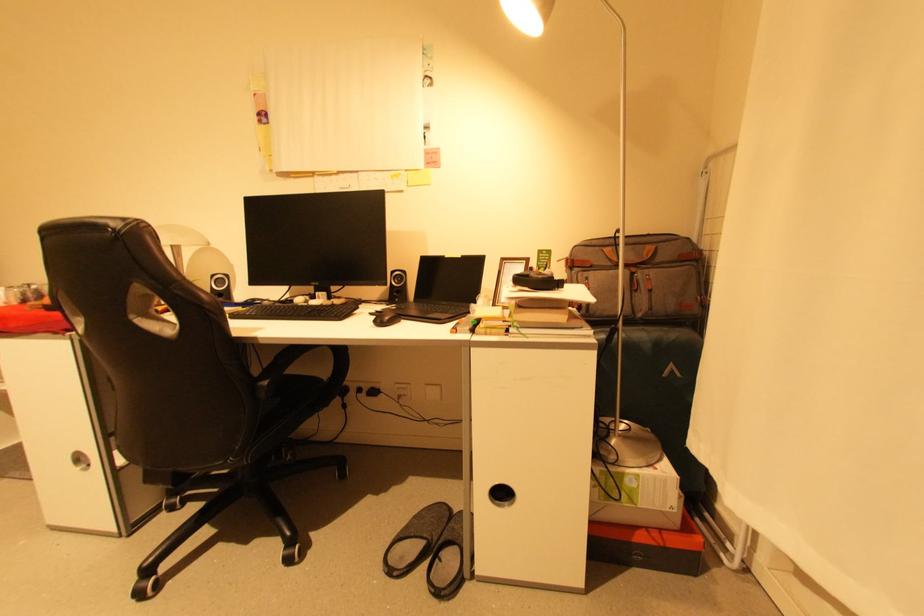
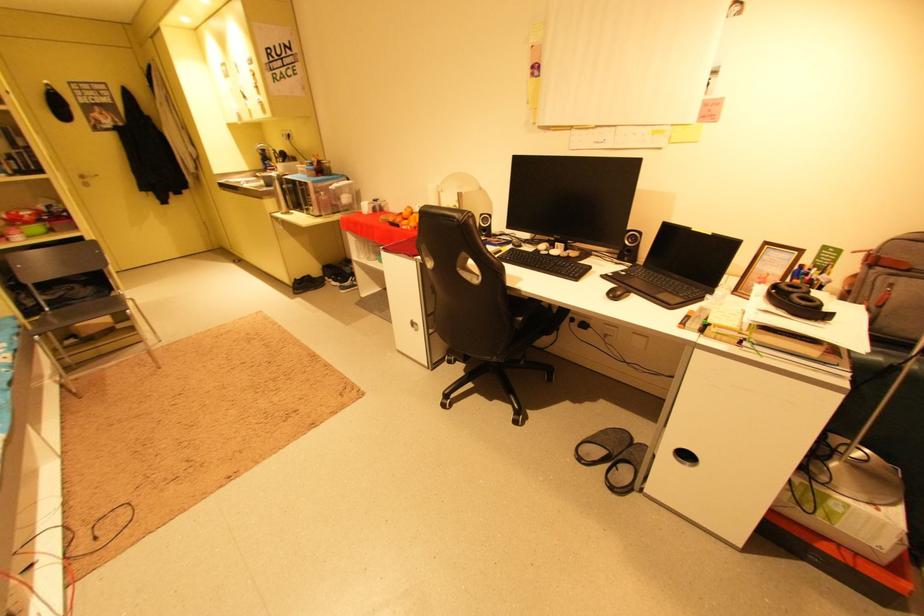
The point at (442, 543) is marked in the first image. Where is the corresponding point in the second image?

(623, 456)